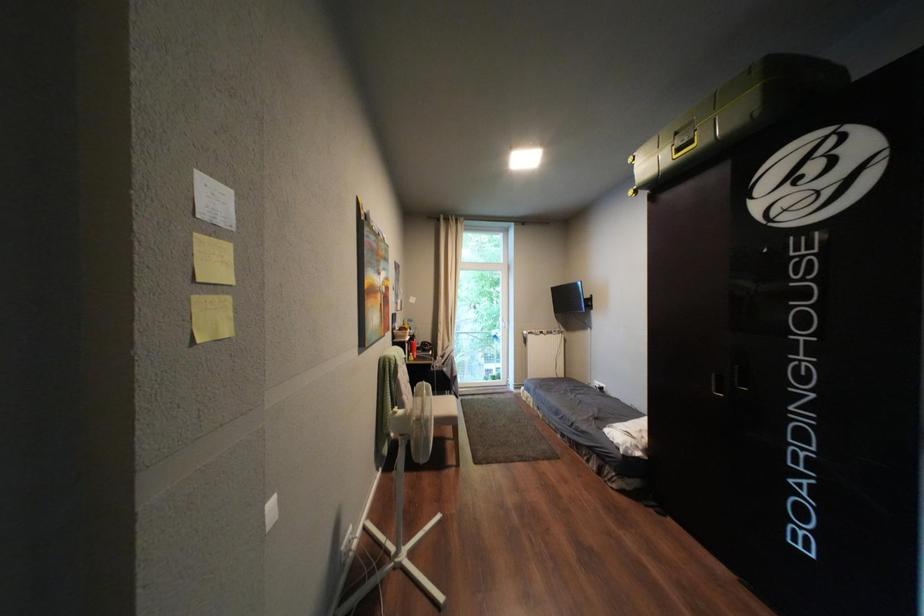
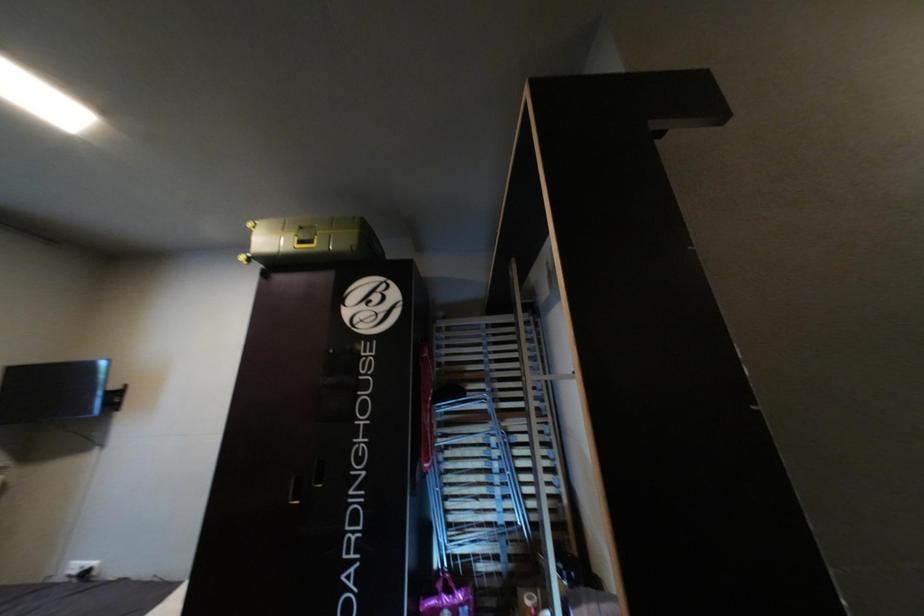
Based on the continuous images, in which direction is the camera rotating?

The camera's rotation is toward right-up.